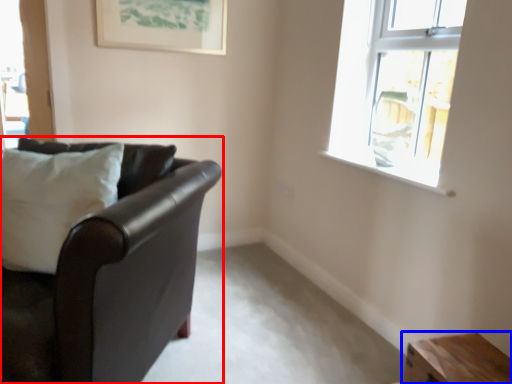
Question: Among these objects, which one is farthest to the camera, studio couch (highlighted by a red box) or table (highlighted by a blue box)?

Choices:
 (A) studio couch
 (B) table

Answer: (B)